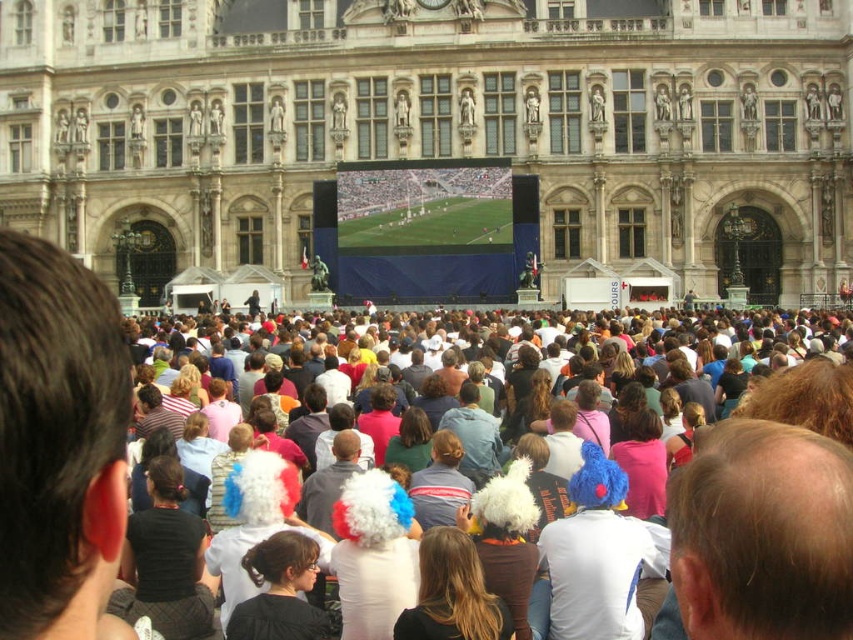
Does white fluffy wigs at center have a greater height compared to green grass field at center?

Yes, white fluffy wigs at center is taller than green grass field at center.

Does white fluffy wigs at center appear on the left side of green grass field at center?

No, white fluffy wigs at center is not to the left of green grass field at center.

The image size is (853, 640). What do you see at coordinates (791, 369) in the screenshot? I see `white fluffy wigs at center` at bounding box center [791, 369].

Locate an element on the screen. This screenshot has width=853, height=640. white fluffy wigs at center is located at coordinates [x=791, y=369].

Measure the distance between stone facade building at center and green grass field at center.

A distance of 10.19 meters exists between stone facade building at center and green grass field at center.

From the picture: Who is shorter, stone facade building at center or green grass field at center?

green grass field at center

This screenshot has height=640, width=853. What do you see at coordinates (436, 124) in the screenshot?
I see `stone facade building at center` at bounding box center [436, 124].

At what (x,y) coordinates should I click in order to perform the action: click on stone facade building at center. Please return your answer as a coordinate pair (x, y). This screenshot has width=853, height=640. Looking at the image, I should click on (436, 124).

Can you confirm if stone facade building at center is taller than white fluffy wigs at center?

Correct, stone facade building at center is much taller as white fluffy wigs at center.

Consider the image. Does stone facade building at center have a lesser width compared to white fluffy wigs at center?

No.

Based on the photo, who is more distant from viewer, (485, 19) or (721, 314)?

Positioned behind is point (485, 19).

You are a GUI agent. You are given a task and a screenshot of the screen. Output one action in this format:
    pyautogui.click(x=<x>, y=<y>)
    Task: Click on the stone facade building at center
    Image resolution: width=853 pixels, height=640 pixels.
    Given the screenshot: What is the action you would take?
    pyautogui.click(x=436, y=124)